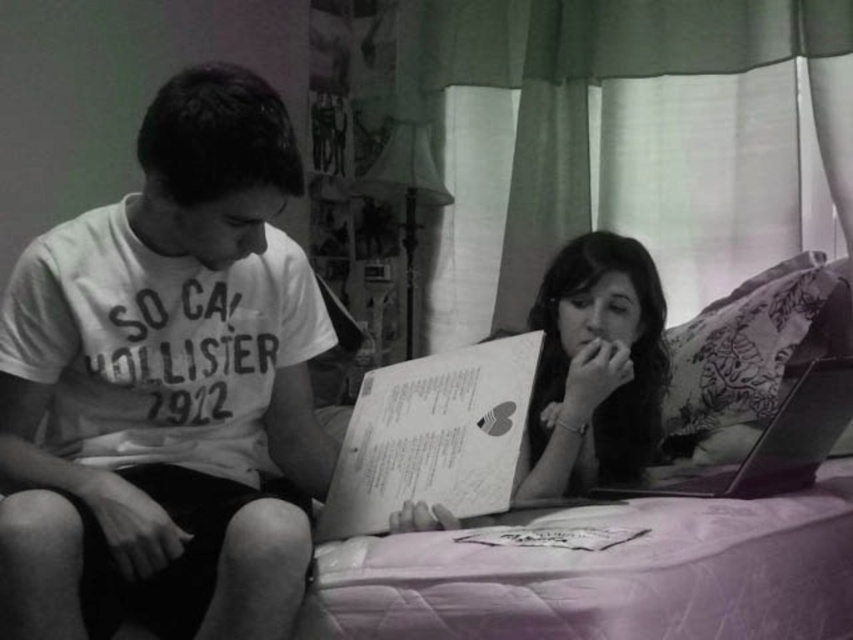
Question: Can you confirm if floral fabric pillow at upper right is positioned above metallic silver laptop at lower right?

Choices:
 (A) no
 (B) yes

Answer: (B)

Question: In this image, where is white cotton t-shirt at left located relative to floral fabric pillow at upper right?

Choices:
 (A) left
 (B) right

Answer: (A)

Question: Which object is the farthest from the metallic silver laptop at lower right?

Choices:
 (A) floral fabric pillow at upper right
 (B) paperback book at center

Answer: (B)

Question: Which object appears closest to the camera in this image?

Choices:
 (A) smooth paper book at center
 (B) paperback book at center

Answer: (B)

Question: Which is farther from the smooth paper book at center?

Choices:
 (A) metallic silver laptop at lower right
 (B) white cotton t-shirt at left
 (C) floral fabric pillow at upper right

Answer: (B)

Question: Can you confirm if metallic silver laptop at lower right is positioned above pink quilted bed at center?

Choices:
 (A) yes
 (B) no

Answer: (B)